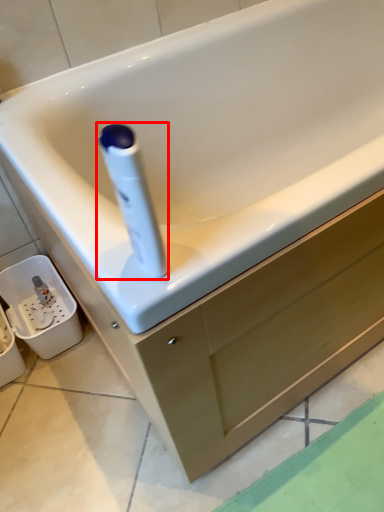
Question: From the image's perspective, considering the relative positions of cleaning product (annotated by the red box) and drawer in the image provided, where is cleaning product (annotated by the red box) located with respect to the staircase?

Choices:
 (A) above
 (B) below

Answer: (A)